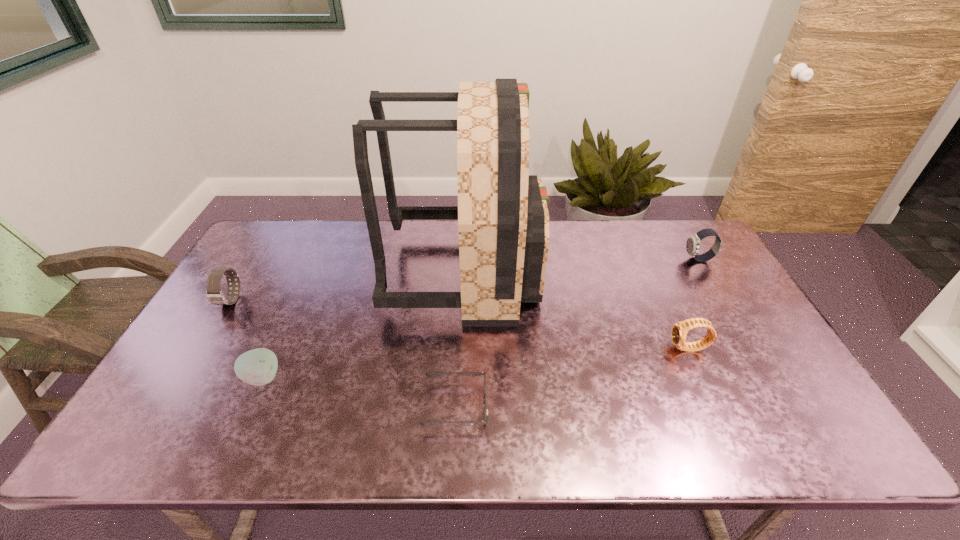
Identify which object is located as the fifth nearest to the second farthest watch. Please provide its 2D coordinates. Your answer should be formatted as a tuple, i.e. [(x, y)], where the tuple contains the x and y coordinates of a point satisfying the conditions above.

[(693, 242)]

You are a GUI agent. You are given a task and a screenshot of the screen. Output one action in this format:
    pyautogui.click(x=<x>, y=<y>)
    Task: Click on the object that is the third closest to the rightmost object
    This screenshot has height=540, width=960.
    Given the screenshot: What is the action you would take?
    pyautogui.click(x=426, y=423)

Identify the location of watch that is the second closest to the leftmost object. pos(693,242).

Locate an element on the screen. the second closest watch to the nearest watch is located at coordinates (214, 294).

This screenshot has height=540, width=960. What are the coordinates of `vacant area in the image that satisfies the following two spatial constraints: 1. on the front face of the backpack; 2. on the face of the leftmost watch` in the screenshot? It's located at (463, 300).